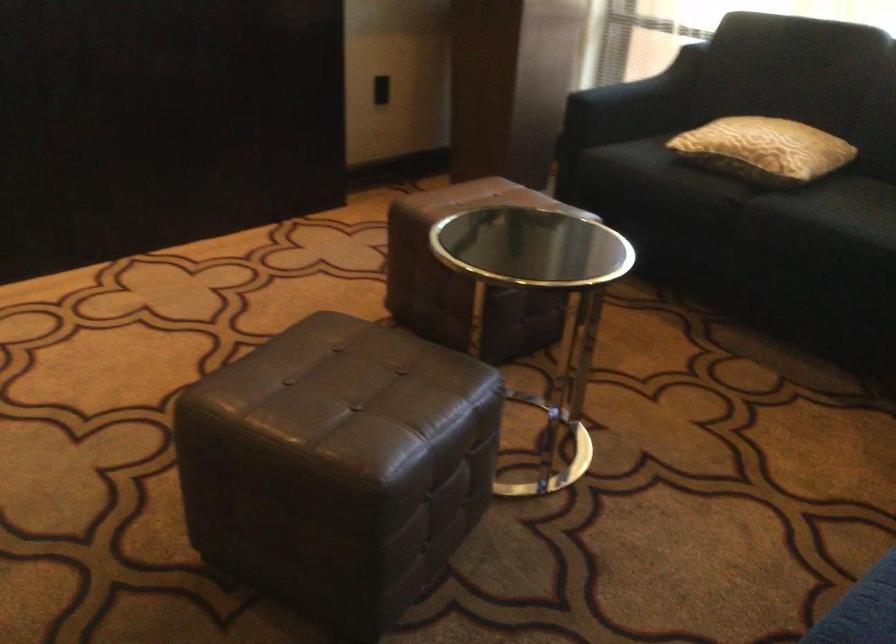
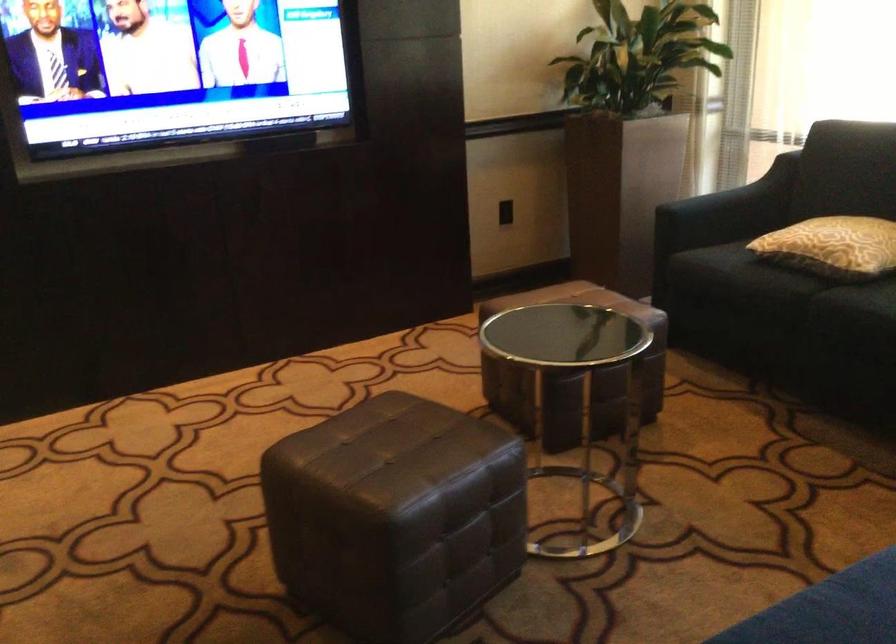
Locate, in the second image, the point that corresponds to (392,474) in the first image.

(394, 516)